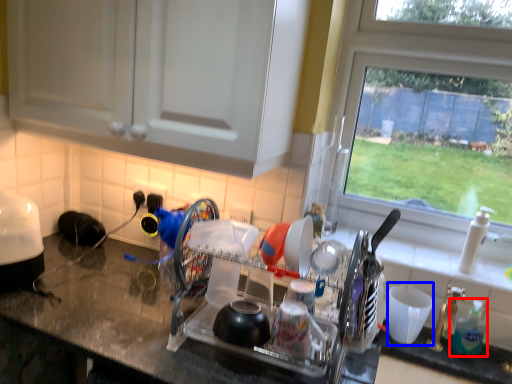
Question: Which of the following is the farthest to the observer, soap dispenser (highlighted by a red box) or tableware (highlighted by a blue box)?

Choices:
 (A) soap dispenser
 (B) tableware

Answer: (B)